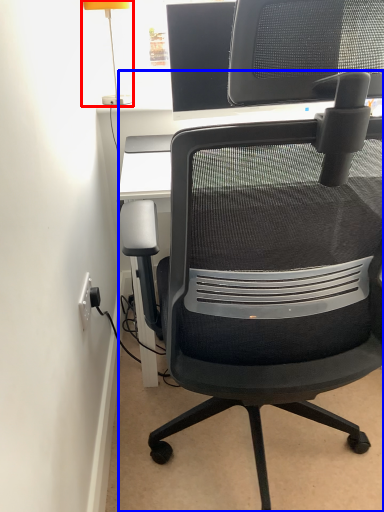
Question: Which object is further to the camera taking this photo, table lamp (highlighted by a red box) or chair (highlighted by a blue box)?

Choices:
 (A) table lamp
 (B) chair

Answer: (A)